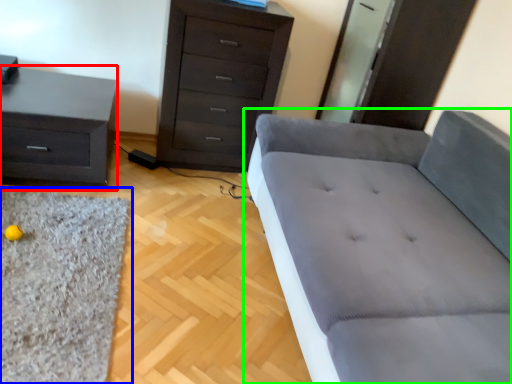
Question: Which object is the closest to the nightstand (highlighted by a red box)? Choose among these: mat (highlighted by a blue box) or studio couch (highlighted by a green box).

Choices:
 (A) mat
 (B) studio couch

Answer: (A)